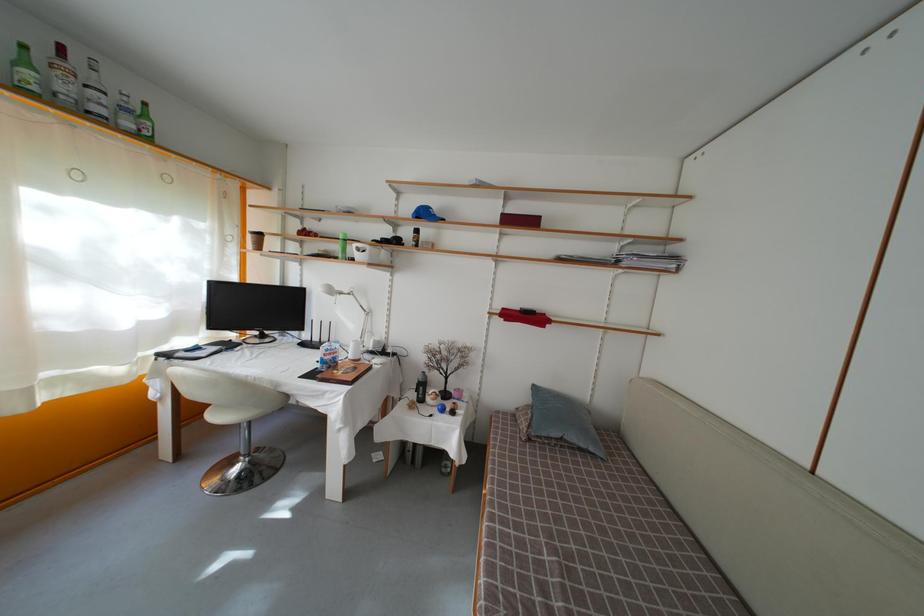
What do you see at coordinates (25, 71) in the screenshot?
I see `the small green bottle` at bounding box center [25, 71].